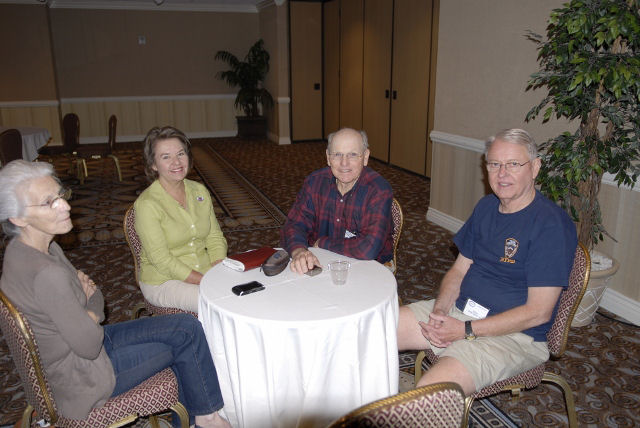
At what (x,y) coordinates should I click in order to perform the action: click on white table cloth. Please return your answer as a coordinate pair (x, y). Image resolution: width=640 pixels, height=428 pixels. Looking at the image, I should click on [x=251, y=335].